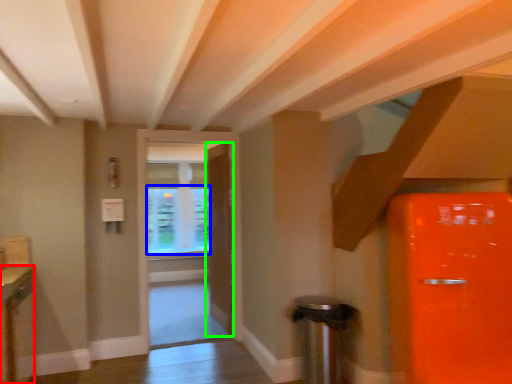
Question: Which is farther away from cabinetry (highlighted by a red box)? window screen (highlighted by a blue box) or door (highlighted by a green box)?

Choices:
 (A) window screen
 (B) door

Answer: (A)